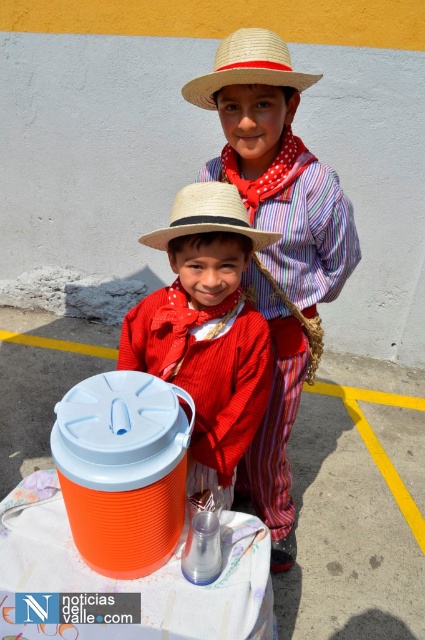
You are organizing a picnic and need to choose between the matte plastic bucket at center and the strawhat at upper center to carry snacks. Which item can hold more snacks?

The matte plastic bucket at center has a larger size compared to the strawhat at upper center, so it can hold more snacks.

You are a photographer setting up for a photo shoot. You need to adjust the camera angle so that both the matte straw hat at center and the strawhat at center are clearly visible. Based on their positions, which one should you focus on first to ensure it is in frame?

The matte straw hat at center is below the strawhat at center, so you should focus on the strawhat at center first to ensure it stays in frame as you adjust the camera angle.